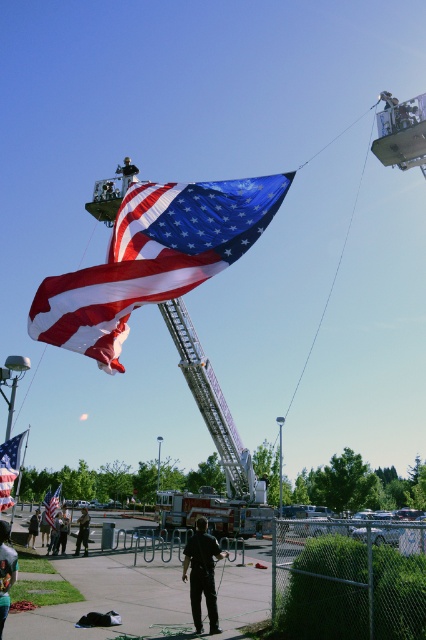
Question: Which object appears farthest from the camera in this image?

Choices:
 (A) matte red flag at center
 (B) dark green uniform at center
 (C) dark blue jeans at center
 (D) dark gray uniform at center

Answer: (A)

Question: Is matte red flag at center to the left of dark blue jeans at center from the viewer's perspective?

Choices:
 (A) yes
 (B) no

Answer: (A)

Question: Is dark gray uniform at center behind dark brown leather jacket at lower left?

Choices:
 (A) yes
 (B) no

Answer: (B)

Question: Is black matte person at center below dark gray uniform at center?

Choices:
 (A) yes
 (B) no

Answer: (B)

Question: Among these points, which one is farthest from the camera?

Choices:
 (A) (5, 612)
 (B) (3, 460)
 (C) (83, 531)
 (D) (54, 552)

Answer: (D)

Question: Which of the following is the closest to the observer?

Choices:
 (A) american flag at center
 (B) dark blue jeans at center
 (C) matte fabric flag at center

Answer: (C)